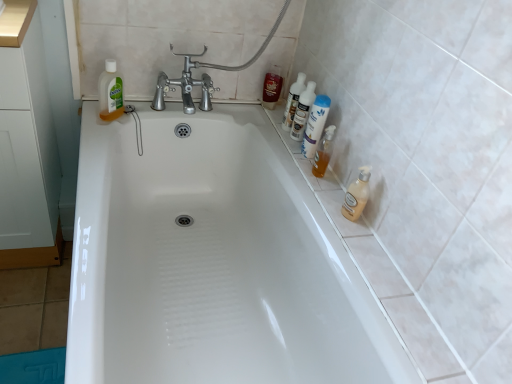
Question: Can you confirm if translucent plastic bottles at upper right, marked as the 3th cleaning product in a right-to-left arrangement, is smaller than white glossy bottles at upper right, the 2th toiletry from the top?

Choices:
 (A) no
 (B) yes

Answer: (A)

Question: Does translucent plastic bottles at upper right, marked as the 3th cleaning product in a right-to-left arrangement, have a greater width compared to white glossy bottles at upper right, the 2th toiletry in the front-to-back sequence?

Choices:
 (A) no
 (B) yes

Answer: (B)

Question: Would you say white glossy bottles at upper right, the 2th toiletry from the top, is part of translucent plastic bottles at upper right, marked as the 3th cleaning product in a right-to-left arrangement,'s contents?

Choices:
 (A) no
 (B) yes

Answer: (A)

Question: From the image's perspective, is translucent plastic bottles at upper right, marked as the 3th cleaning product in a right-to-left arrangement, located above white glossy bottles at upper right, the 2th toiletry in the front-to-back sequence?

Choices:
 (A) no
 (B) yes

Answer: (B)

Question: Is translucent plastic bottles at upper right, marked as the 3th cleaning product in a right-to-left arrangement, turned away from white glossy bottles at upper right, the 2th toiletry in the front-to-back sequence?

Choices:
 (A) no
 (B) yes

Answer: (A)

Question: Visually, is translucent plastic bottle at right, the 3th toiletry positioned from the back, positioned to the left or to the right of shiny red can at upper right, positioned as the 1th toiletry in left-to-right order?

Choices:
 (A) right
 (B) left

Answer: (A)

Question: Considering the positions of translucent plastic bottle at right, the 3th toiletry positioned from the back, and shiny red can at upper right, the first toiletry positioned from the back, in the image, is translucent plastic bottle at right, the 3th toiletry positioned from the back, taller or shorter than shiny red can at upper right, the first toiletry positioned from the back,?

Choices:
 (A) tall
 (B) short

Answer: (A)

Question: Based on their sizes in the image, would you say translucent plastic bottle at right, which is the 3th toiletry from top to bottom, is bigger or smaller than shiny red can at upper right, positioned as the 1th toiletry in left-to-right order?

Choices:
 (A) small
 (B) big

Answer: (B)

Question: From a real-world perspective, is translucent plastic bottle at right, the 1th toiletry positioned from the right, physically located above or below shiny red can at upper right, positioned as the 1th toiletry in left-to-right order?

Choices:
 (A) below
 (B) above

Answer: (B)

Question: Looking at their shapes, would you say white glossy bathtub at center is wider or thinner than shiny red can at upper right, the 3th toiletry from the right?

Choices:
 (A) thin
 (B) wide

Answer: (B)

Question: From the image's perspective, is white glossy bathtub at center located above or below shiny red can at upper right, the first toiletry positioned from the back?

Choices:
 (A) above
 (B) below

Answer: (B)

Question: Considering the positions of white glossy bathtub at center and shiny red can at upper right, the first toiletry positioned from the back, in the image, is white glossy bathtub at center taller or shorter than shiny red can at upper right, the first toiletry positioned from the back,?

Choices:
 (A) short
 (B) tall

Answer: (B)

Question: Which is correct: white glossy bathtub at center is inside shiny red can at upper right, positioned as the 1th toiletry in left-to-right order, or outside of it?

Choices:
 (A) outside
 (B) inside

Answer: (A)

Question: Is translucent plastic bottle at upper left, acting as the 4th cleaning product starting from the right, spatially inside white glossy bathtub at center, or outside of it?

Choices:
 (A) inside
 (B) outside

Answer: (B)

Question: Is point (121, 104) positioned closer to the camera than point (248, 195)?

Choices:
 (A) farther
 (B) closer

Answer: (B)